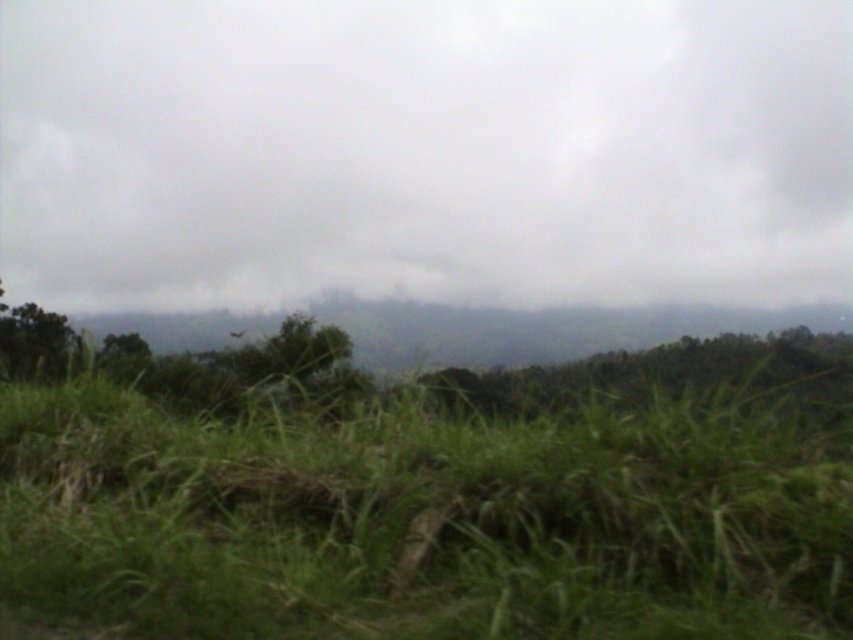
You are standing in the middle of the natural landscape shown. Looking up, you see the gray cloudy sky at upper center and the green leafy tree at center. Which object is positioned higher in the scene?

The gray cloudy sky at upper center is positioned higher than the green leafy tree at center because it is located above it.

Based on the scene description, what is located at the point with coordinates (422, 518)?

The point at coordinates (422, 518) is occupied by the green grassy field at lower center.

You are an observer standing in the middle of the natural landscape. You notice the gray cloudy sky at upper center and the green leafy tree at center. Which object appears taller in the scene?

The gray cloudy sky at upper center is taller than the green leafy tree at center.